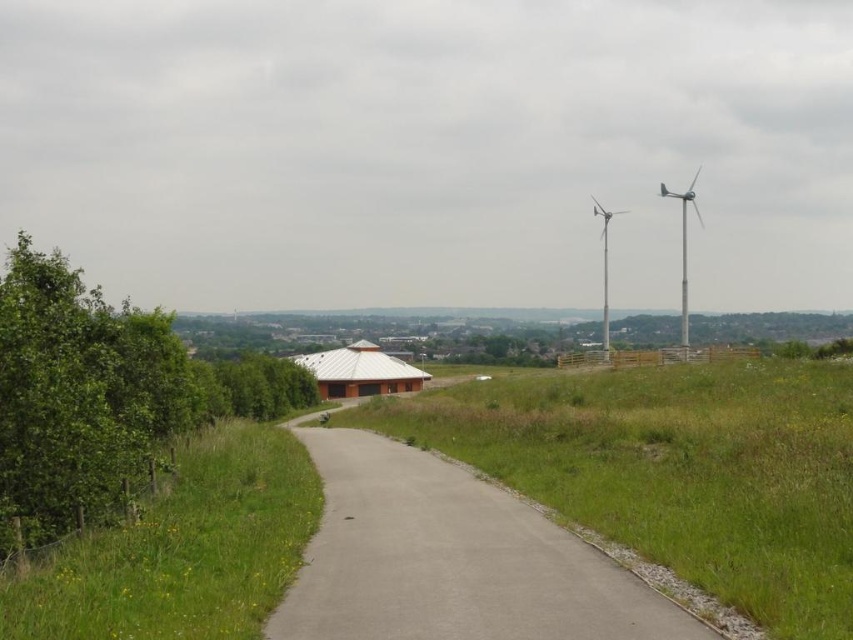
Question: Does gray asphalt path at center have a greater width compared to silver metallic wind turbine at center-right?

Choices:
 (A) yes
 (B) no

Answer: (B)

Question: Which of the following is the farthest from the observer?

Choices:
 (A) silver metallic wind turbine at upper right
 (B) silver metallic wind turbine at center-right

Answer: (A)

Question: Which point is farther from the camera taking this photo?

Choices:
 (A) (686, 209)
 (B) (608, 340)
 (C) (616, 572)
 (D) (281, 577)

Answer: (A)

Question: Is gray asphalt path at center below green grass at left?

Choices:
 (A) no
 (B) yes

Answer: (B)

Question: Which of the following is the farthest from the observer?

Choices:
 (A) (682, 337)
 (B) (602, 292)

Answer: (B)

Question: Can you confirm if gray asphalt path at center is bigger than silver metallic wind turbine at center-right?

Choices:
 (A) yes
 (B) no

Answer: (B)